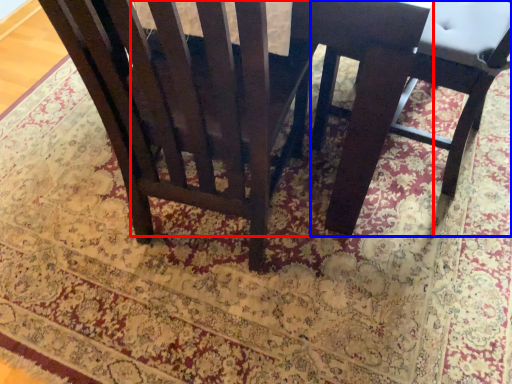
Question: Which object is further to the camera taking this photo, round table (highlighted by a red box) or chair (highlighted by a blue box)?

Choices:
 (A) round table
 (B) chair

Answer: (B)